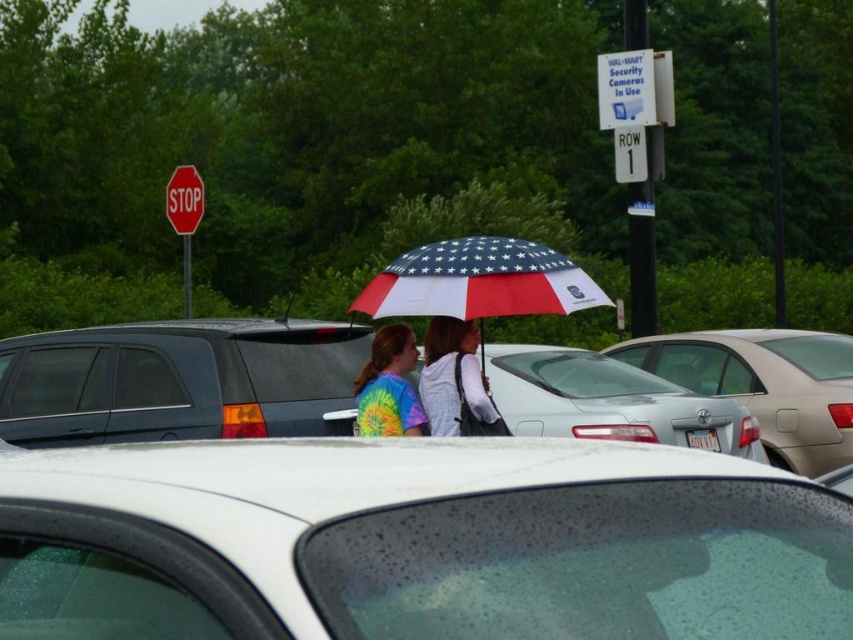
You are a delivery person trying to unload a package that requires a space of 2 meters between the white matte car at center and the nearest object. Is there enough space?

The individuals standing under the umbrella are 1.87 meters away from the white matte car at center, which is less than the required 2 meters. Therefore, there isn not enough space to unload the package safely.